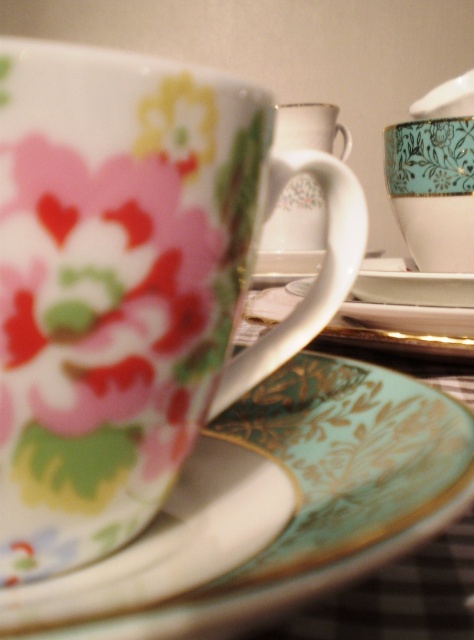
Question: Estimate the real-world distances between objects in this image. Which object is farther from the teal floral plate at center?

Choices:
 (A) floral porcelain mug at upper center
 (B) turquoise glossy mug at upper center
 (C) teal glossy saucer at center
 (D) porcelain floral mug at center

Answer: (D)

Question: Is turquoise glossy mug at upper center smaller than porcelain floral mug at center?

Choices:
 (A) no
 (B) yes

Answer: (B)

Question: Which object appears farthest from the camera in this image?

Choices:
 (A) teal glossy saucer at center
 (B) turquoise glossy mug at upper center
 (C) floral porcelain mug at upper center
 (D) teal floral plate at center

Answer: (B)

Question: Where is floral porcelain mug at upper center located in relation to teal floral plate at center in the image?

Choices:
 (A) left
 (B) right

Answer: (A)

Question: Which is farther from the floral porcelain mug at upper center?

Choices:
 (A) teal glossy saucer at center
 (B) teal floral plate at center
 (C) turquoise glossy mug at upper center
 (D) porcelain floral mug at center

Answer: (D)

Question: Can you confirm if teal glossy saucer at center is positioned below porcelain floral mug at center?

Choices:
 (A) no
 (B) yes

Answer: (B)